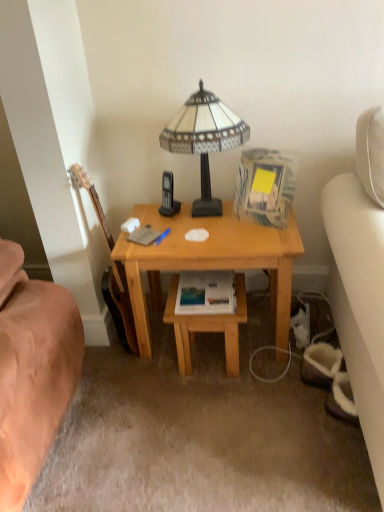
Image resolution: width=384 pixels, height=512 pixels. What are the coordinates of `free space to the left of light brown wood table at center` in the screenshot? It's located at (151, 365).